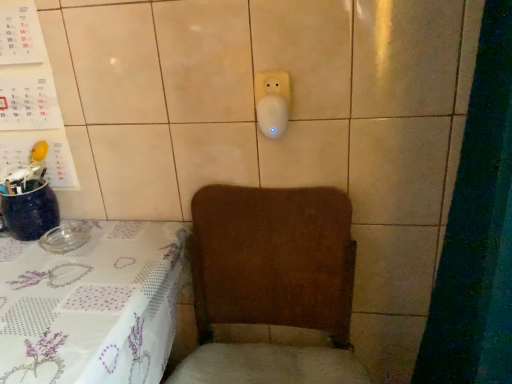
Question: Visually, is brown fabric armchair at lower center positioned to the left or to the right of white plastic socket at upper center?

Choices:
 (A) right
 (B) left

Answer: (B)

Question: Is brown fabric armchair at lower center taller or shorter than white plastic socket at upper center?

Choices:
 (A) short
 (B) tall

Answer: (B)

Question: Estimate the real-world distances between objects in this image. Which object is farther from the brown fabric armchair at lower center?

Choices:
 (A) white plastic socket at upper center
 (B) white printed fabric tablecloth at lower left
 (C) white paper calendar at upper left

Answer: (C)

Question: Based on their relative distances, which object is nearer to the brown fabric armchair at lower center?

Choices:
 (A) white printed fabric tablecloth at lower left
 (B) white paper calendar at upper left
 (C) white plastic socket at upper center

Answer: (A)